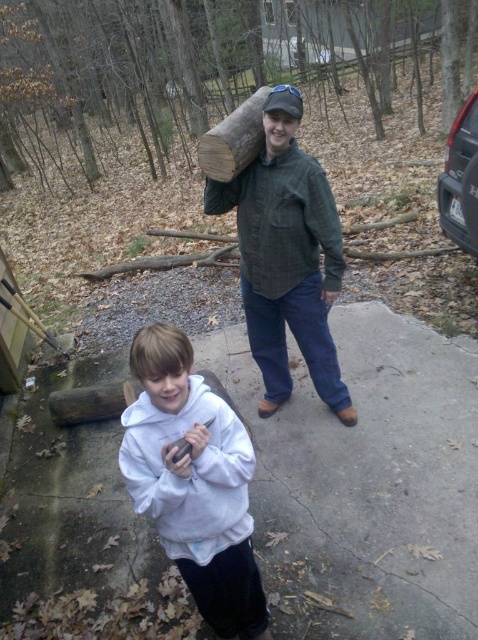
Between white fleece hoodie at center and green corduroy shirt at center, which one appears on the right side from the viewer's perspective?

green corduroy shirt at center is more to the right.

Is white fleece hoodie at center shorter than green corduroy shirt at center?

Indeed, white fleece hoodie at center has a lesser height compared to green corduroy shirt at center.

This screenshot has width=478, height=640. Identify the location of white fleece hoodie at center. (194, 481).

Which is in front, point (361, 336) or point (199, 568)?

Point (199, 568) is more forward.

Can you confirm if concrete at center is bigger than white fleece hoodie at center?

Indeed, concrete at center has a larger size compared to white fleece hoodie at center.

Is point (329, 545) more distant than point (197, 460)?

Yes, it is.

Locate an element on the screen. This screenshot has height=640, width=478. concrete at center is located at coordinates (366, 483).

Does concrete at center come behind green corduroy shirt at center?

No, concrete at center is in front of green corduroy shirt at center.

Does concrete at center appear under green corduroy shirt at center?

Indeed, concrete at center is positioned under green corduroy shirt at center.

Find the location of `concrete at center`. concrete at center is located at coordinates (366, 483).